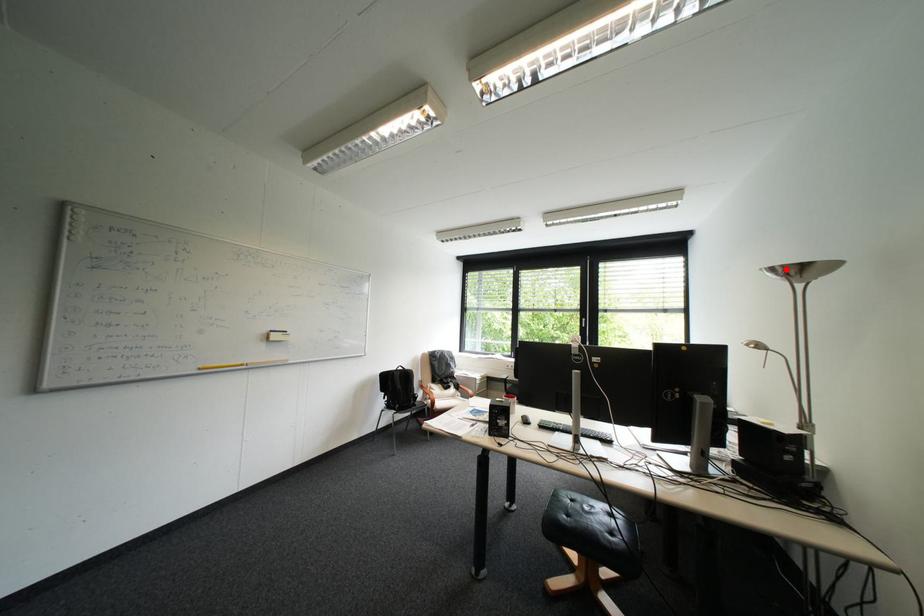
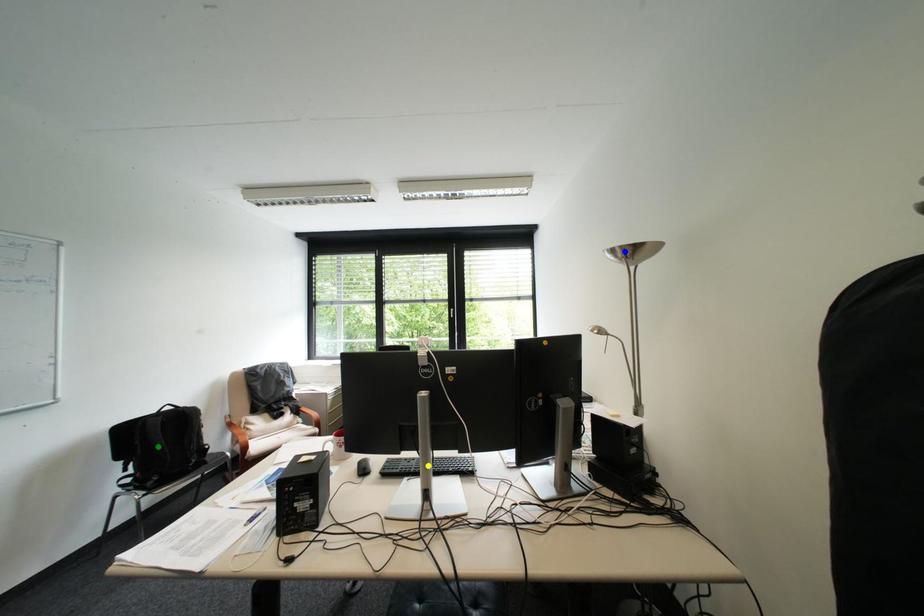
Question: I am providing you with two images of the same scene from different viewpoints. A red point is marked on the first image. You are given multiple points on the second image. Which spot in image 2 lines up with the point in image 1?

Choices:
 (A) green point
 (B) blue point
 (C) yellow point

Answer: (B)